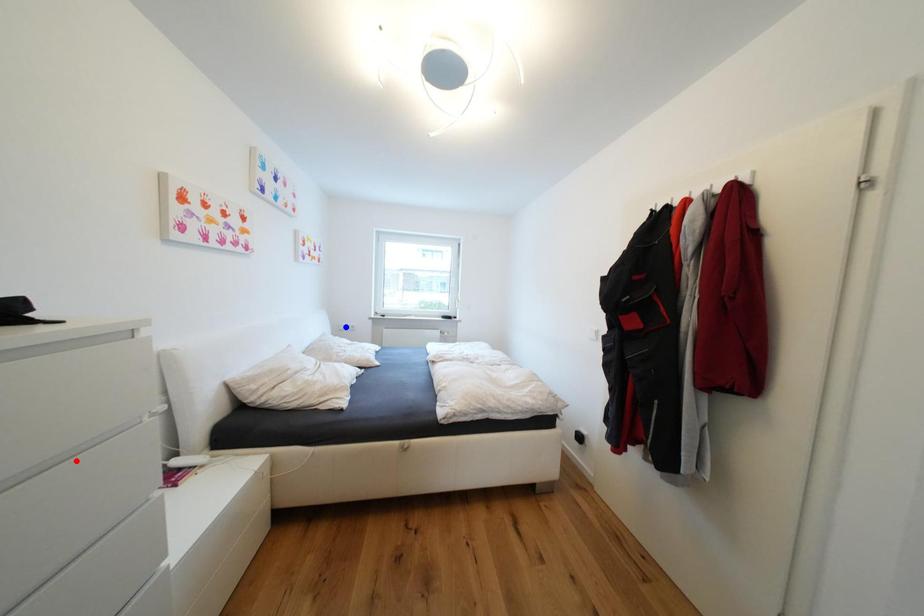
Question: Which of the two points in the image is closer to the camera?

Choices:
 (A) Blue point is closer.
 (B) Red point is closer.

Answer: (B)